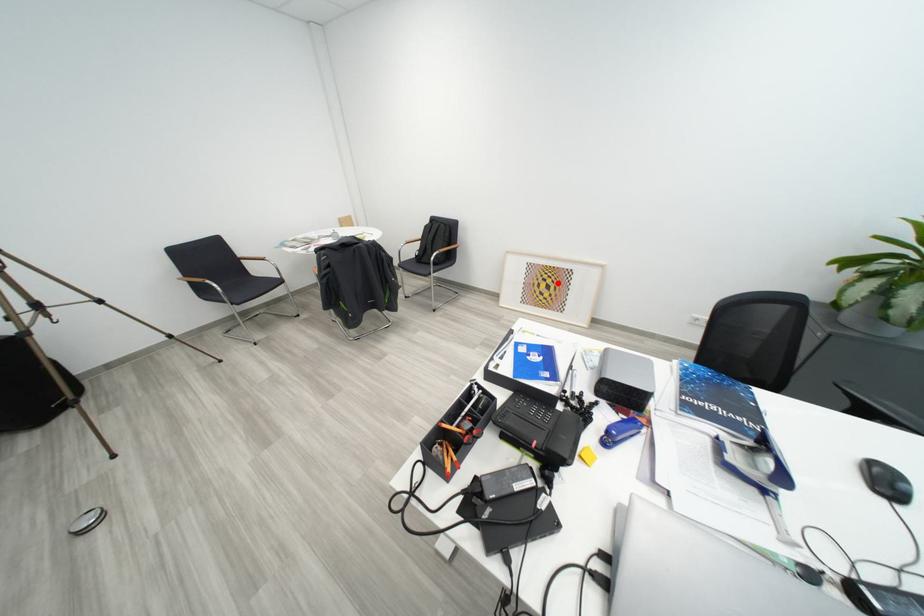
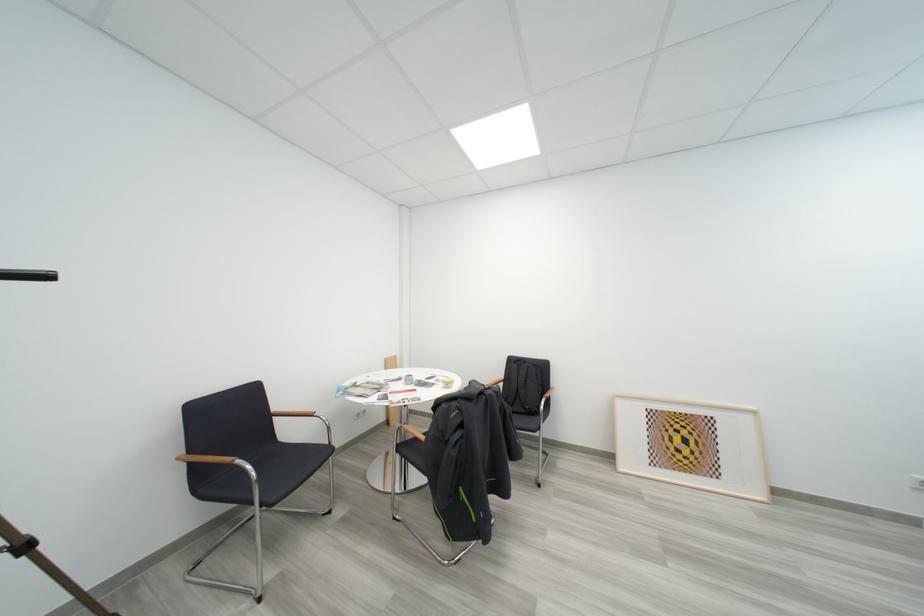
Question: I am providing you with two images of the same scene from different viewpoints. In image1, a red point is highlighted. Considering the same 3D point in image2, which of the following is correct?

Choices:
 (A) It is closer
 (B) It is farther

Answer: (B)